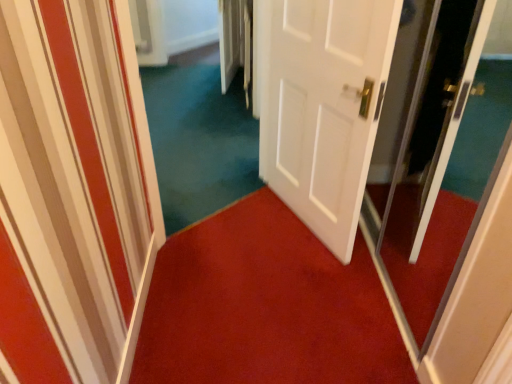
Find the location of a particular element. transparent glass screen door at right is located at coordinates (426, 162).

Describe the element at coordinates (265, 307) in the screenshot. This screenshot has width=512, height=384. I see `red carpet at center` at that location.

You are a GUI agent. You are given a task and a screenshot of the screen. Output one action in this format:
    pyautogui.click(x=<x>, y=<y>)
    Task: Click on the white matte door at center
    
    Given the screenshot: What is the action you would take?
    pyautogui.click(x=323, y=106)

Based on the photo, from a real-world perspective, is red carpet at center positioned under transparent glass screen door at right based on gravity?

Correct, in the physical world, red carpet at center is lower than transparent glass screen door at right.

From the picture: Who is more distant, red carpet at center or transparent glass screen door at right?

red carpet at center is more distant.

Is point (280, 251) farther from camera compared to point (435, 300)?

Yes, point (280, 251) is behind point (435, 300).

Considering the sizes of red carpet at center and transparent glass screen door at right in the image, is red carpet at center wider or thinner than transparent glass screen door at right?

Clearly, red carpet at center has more width compared to transparent glass screen door at right.

Is teal carpet at center positioned with its back to transparent glass screen door at right?

That's not correct — teal carpet at center is not looking away from transparent glass screen door at right.

Considering the sizes of teal carpet at center and transparent glass screen door at right in the image, is teal carpet at center bigger or smaller than transparent glass screen door at right?

Clearly, teal carpet at center is larger in size than transparent glass screen door at right.

Which object is further away from the camera, teal carpet at center or transparent glass screen door at right?

Positioned behind is teal carpet at center.

From the image's perspective, is teal carpet at center located above or below white matte door at center?

teal carpet at center is above white matte door at center.

Which is behind, teal carpet at center or white matte door at center?

teal carpet at center is further from the camera.

Where is `door lying in front of the teal carpet at center`? Image resolution: width=512 pixels, height=384 pixels. door lying in front of the teal carpet at center is located at coordinates (323, 106).

From the picture: Does red carpet at center have a larger size compared to teal carpet at center?

Incorrect, red carpet at center is not larger than teal carpet at center.

Is red carpet at center placed right next to teal carpet at center?

No, red carpet at center is not making contact with teal carpet at center.

Is red carpet at center outside of teal carpet at center?

Absolutely, red carpet at center is external to teal carpet at center.

Is teal carpet at center to the right of red carpet at center from the viewer's perspective?

No, teal carpet at center is not to the right of red carpet at center.

Which point is more distant from viewer, (189,218) or (186,315)?

Point (189,218)

From the picture: Considering their positions, is teal carpet at center located in front of or behind red carpet at center?

teal carpet at center is positioned closer to the viewer than red carpet at center.

From the picture: Choose the correct answer: Is teal carpet at center inside red carpet at center or outside it?

The correct answer is: outside.

From the image's perspective, between transparent glass screen door at right and red carpet at center, who is located below?

red carpet at center.

Looking at this image, is transparent glass screen door at right situated inside red carpet at center or outside?

transparent glass screen door at right is located beyond the bounds of red carpet at center.

Looking at this image, which object is more forward, transparent glass screen door at right or red carpet at center?

transparent glass screen door at right is more forward.

Considering the relative sizes of transparent glass screen door at right and red carpet at center in the image provided, is transparent glass screen door at right shorter than red carpet at center?

In fact, transparent glass screen door at right may be taller than red carpet at center.

Identify the location of screen door in front of the teal carpet at center. The width and height of the screenshot is (512, 384). (426, 162).

Is transparent glass screen door at right spatially inside teal carpet at center, or outside of it?

transparent glass screen door at right is not inside teal carpet at center, it's outside.

Which object is positioned more to the right, transparent glass screen door at right or teal carpet at center?

From the viewer's perspective, transparent glass screen door at right appears more on the right side.

Which object is closer to the camera, transparent glass screen door at right or teal carpet at center?

transparent glass screen door at right is in front.

Image resolution: width=512 pixels, height=384 pixels. I want to click on screen door on the right of red carpet at center, so click(426, 162).

Locate an element on the screen. This screenshot has height=384, width=512. plain on the left of transparent glass screen door at right is located at coordinates (199, 137).

Based on the photo, from the image, which object appears to be nearer to transparent glass screen door at right, red carpet at center or white matte door at center?

The object closer to transparent glass screen door at right is white matte door at center.

When comparing their distances from red carpet at center, does teal carpet at center or transparent glass screen door at right seem further?

teal carpet at center lies further to red carpet at center than the other object.

Based on their spatial positions, is teal carpet at center or red carpet at center closer to transparent glass screen door at right?

The object closer to transparent glass screen door at right is red carpet at center.

Estimate the real-world distances between objects in this image. Which object is further from red carpet at center, white matte door at center or transparent glass screen door at right?

Based on the image, transparent glass screen door at right appears to be further to red carpet at center.

Consider the image. From the image, which object appears to be nearer to teal carpet at center, white matte door at center or red carpet at center?

white matte door at center is closer to teal carpet at center.

Which object lies nearer to the anchor point red carpet at center, white matte door at center or teal carpet at center?

white matte door at center is positioned closer to the anchor red carpet at center.

When comparing their distances from white matte door at center, does transparent glass screen door at right or teal carpet at center seem closer?

Based on the image, transparent glass screen door at right appears to be nearer to white matte door at center.

When comparing their distances from red carpet at center, does transparent glass screen door at right or teal carpet at center seem closer?

transparent glass screen door at right.

At what (x,y) coordinates should I click in order to perform the action: click on doormat located between teal carpet at center and transparent glass screen door at right in the left-right direction. Please return your answer as a coordinate pair (x, y). The height and width of the screenshot is (384, 512). Looking at the image, I should click on (265, 307).

Find the location of a particular element. screen door between white matte door at center and red carpet at center in the up-down direction is located at coordinates (426, 162).

Where is `door located between teal carpet at center and transparent glass screen door at right in the left-right direction`? The width and height of the screenshot is (512, 384). door located between teal carpet at center and transparent glass screen door at right in the left-right direction is located at coordinates (323, 106).

Image resolution: width=512 pixels, height=384 pixels. What are the coordinates of `door that lies between teal carpet at center and red carpet at center from top to bottom` in the screenshot? It's located at (323, 106).